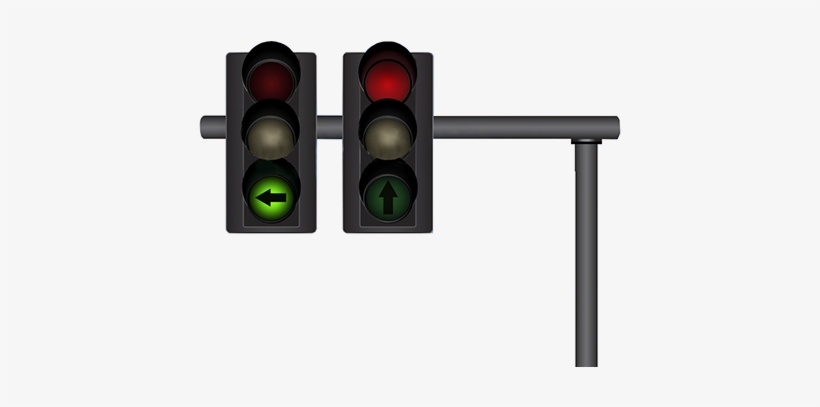
Locate an element on the screen. non illuminated lights is located at coordinates (266, 64), (265, 145), (380, 135), (383, 196).